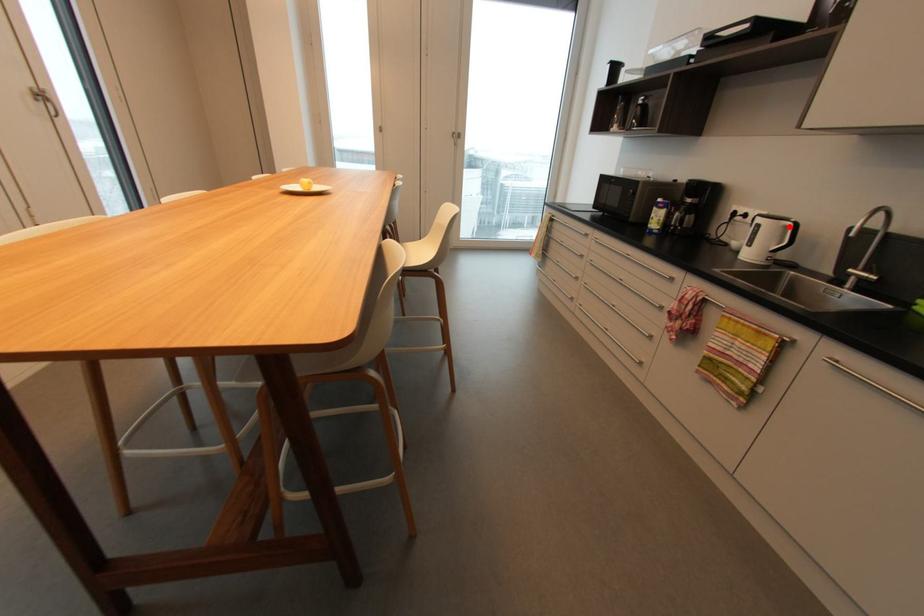
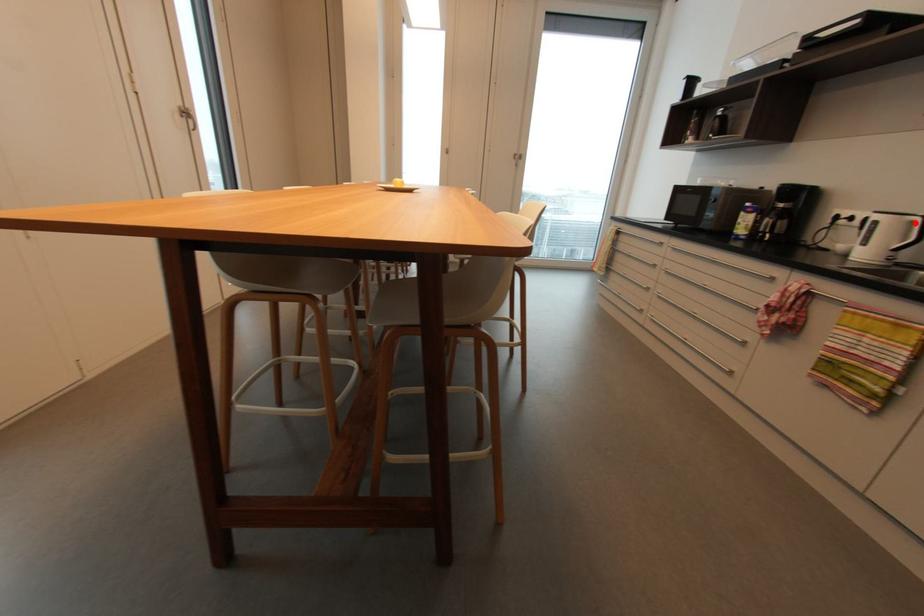
I am providing you with two images of the same scene from different viewpoints. A red point is marked on the first image and another point is marked on the second image. Is the marked point in image1 the same physical position as the marked point in image2?

Yes